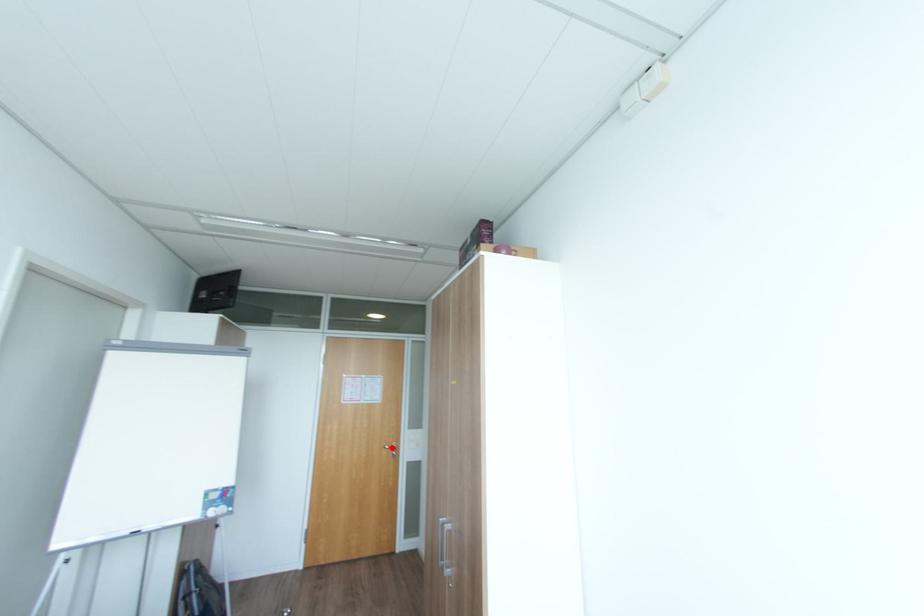
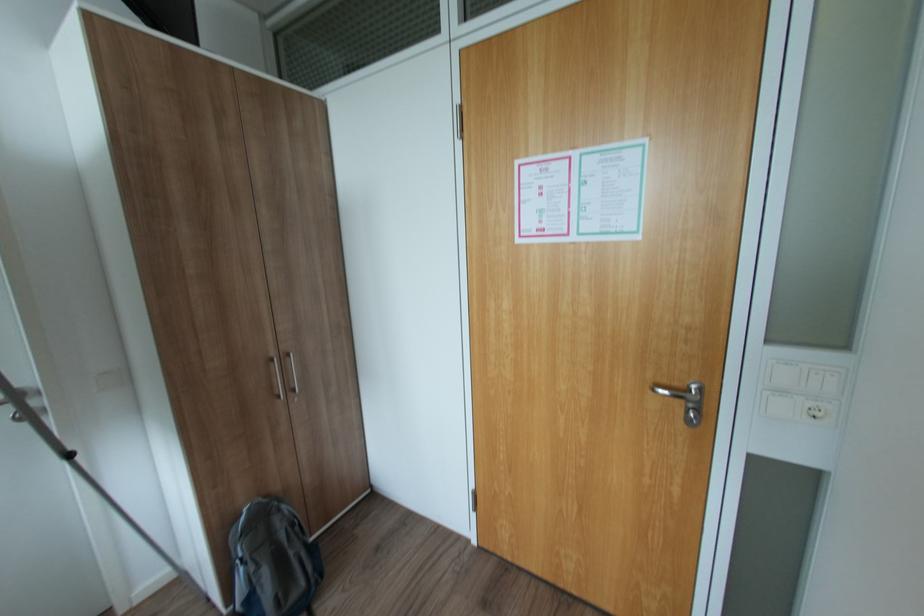
Question: A red point is marked in image1. In image2, is the corresponding 3D point closer to the camera or farther? Reply with the corresponding letter.

Choices:
 (A) The corresponding 3D point is closer.
 (B) The corresponding 3D point is farther.

Answer: (A)